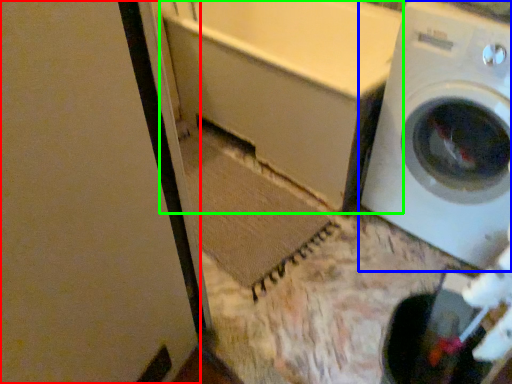
Question: Based on their relative distances, which object is nearer to screen door (highlighted by a red box)? Choose from washing machine (highlighted by a blue box) and bath (highlighted by a green box).

Choices:
 (A) washing machine
 (B) bath

Answer: (B)